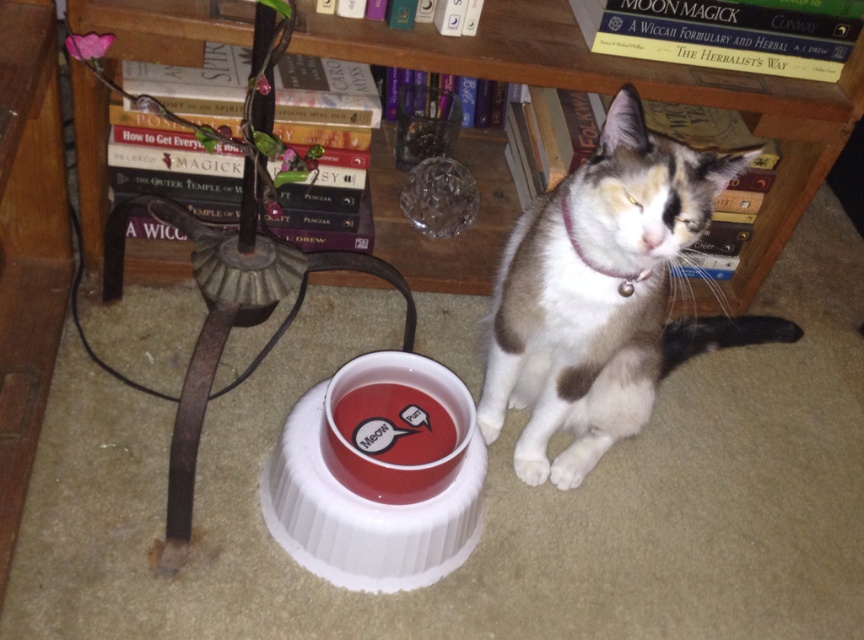
Is white fur cat at center closer to camera compared to matte red bowl at center?

That is True.

Locate an element on the screen. white fur cat at center is located at coordinates (602, 296).

Locate an element on the screen. This screenshot has height=640, width=864. white fur cat at center is located at coordinates (602, 296).

Which is more to the right, wooden bookcase at upper center or white fur cat at center?

From the viewer's perspective, white fur cat at center appears more on the right side.

Between wooden bookcase at upper center and white fur cat at center, which one has less height?

Standing shorter between the two is wooden bookcase at upper center.

You are a GUI agent. You are given a task and a screenshot of the screen. Output one action in this format:
    pyautogui.click(x=<x>, y=<y>)
    Task: Click on the wooden bookcase at upper center
    The width and height of the screenshot is (864, 640).
    Given the screenshot: What is the action you would take?
    pyautogui.click(x=640, y=97)

Does wooden bookcase at upper center appear on the right side of matte red bowl at center?

Correct, you'll find wooden bookcase at upper center to the right of matte red bowl at center.

Between point (811, 154) and point (473, 404), which one is positioned behind?

The point (811, 154) is behind.

Image resolution: width=864 pixels, height=640 pixels. I want to click on wooden bookcase at upper center, so click(x=640, y=97).